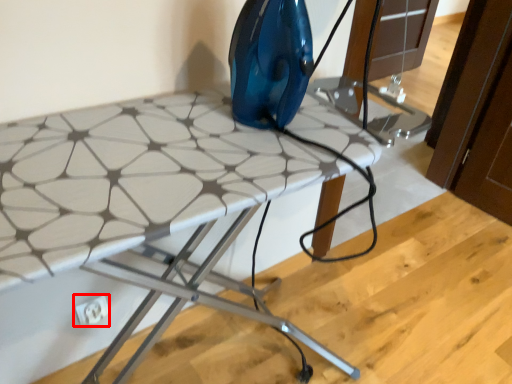
Question: From the image's perspective, considering the relative positions of electric outlet (annotated by the red box) and table in the image provided, where is electric outlet (annotated by the red box) located with respect to the staircase?

Choices:
 (A) below
 (B) above

Answer: (A)